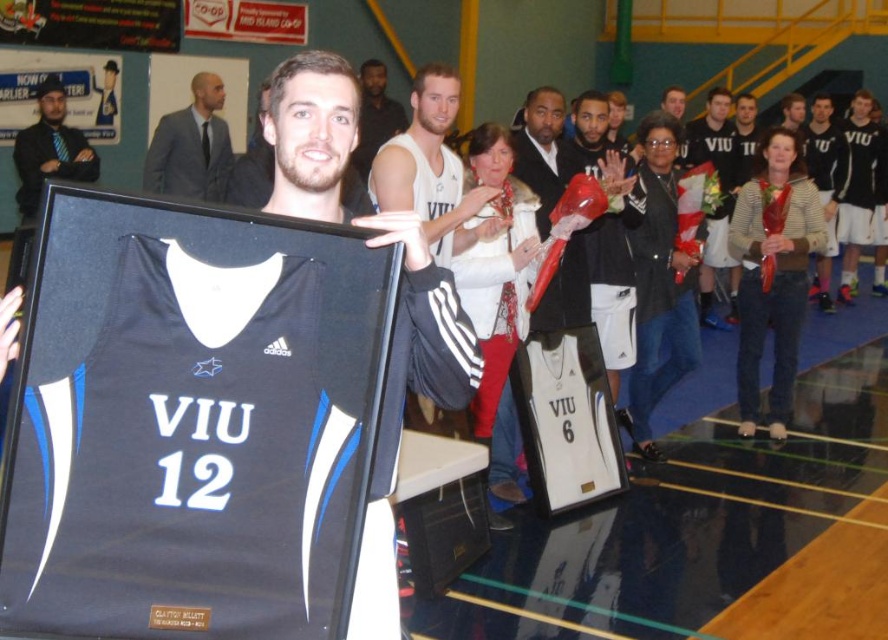
Question: Does white jersey at center appear over matte black jacket at upper left?

Choices:
 (A) no
 (B) yes

Answer: (A)

Question: Which of the following is the farthest from the observer?

Choices:
 (A) white jersey at center
 (B) matte black jacket at upper left

Answer: (B)

Question: Which point is farther to the camera?

Choices:
 (A) matte white jersey at center
 (B) matte black jacket at upper left
 (C) white jersey at center

Answer: (A)

Question: Among these points, which one is farthest from the camera?

Choices:
 (A) (192, 90)
 (B) (363, 67)

Answer: (B)

Question: Does matte black jacket at upper left appear on the left side of matte white jersey at center?

Choices:
 (A) no
 (B) yes

Answer: (B)

Question: Does matte black suit at upper left appear on the right side of matte black jacket at upper left?

Choices:
 (A) yes
 (B) no

Answer: (A)